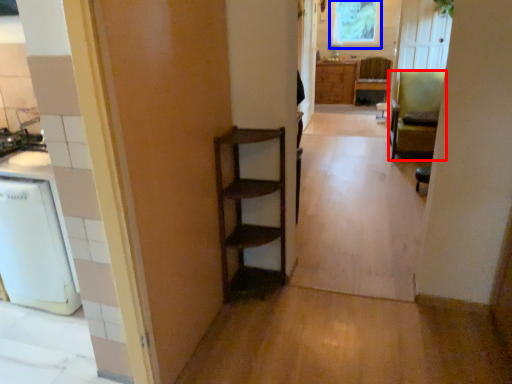
Question: Which object is further to the camera taking this photo, chair (highlighted by a red box) or window screen (highlighted by a blue box)?

Choices:
 (A) chair
 (B) window screen

Answer: (B)